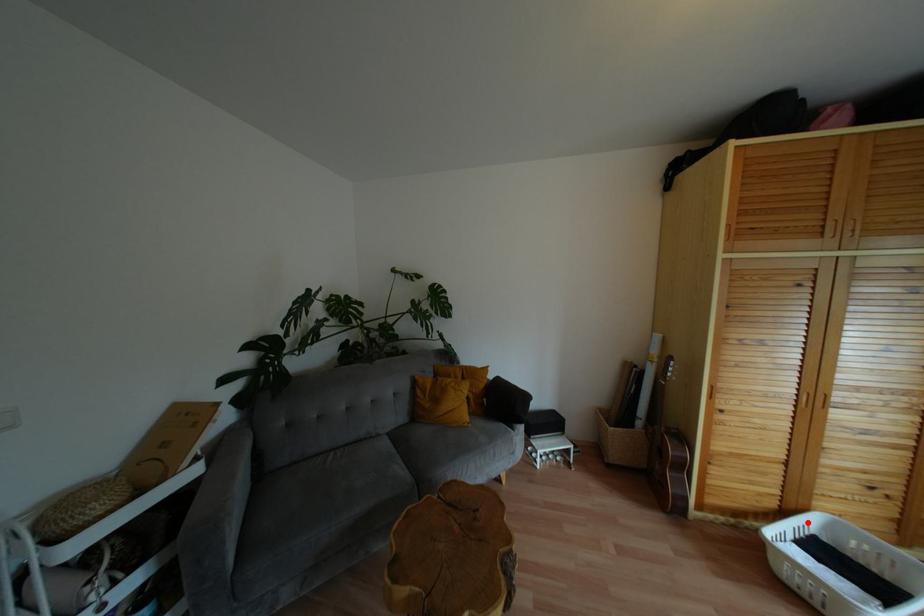
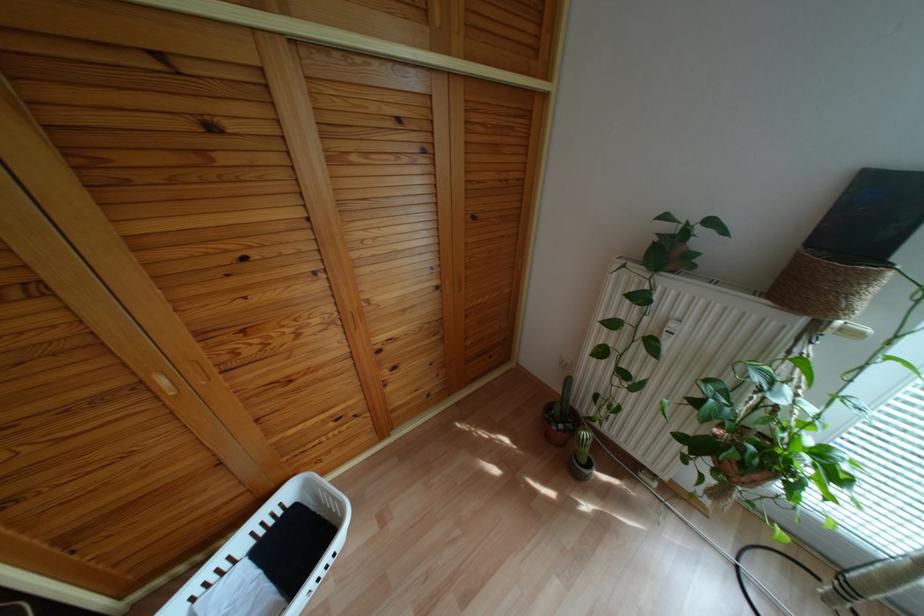
The point at the highlighted location is marked in the first image. Where is the corresponding point in the second image?

(287, 493)